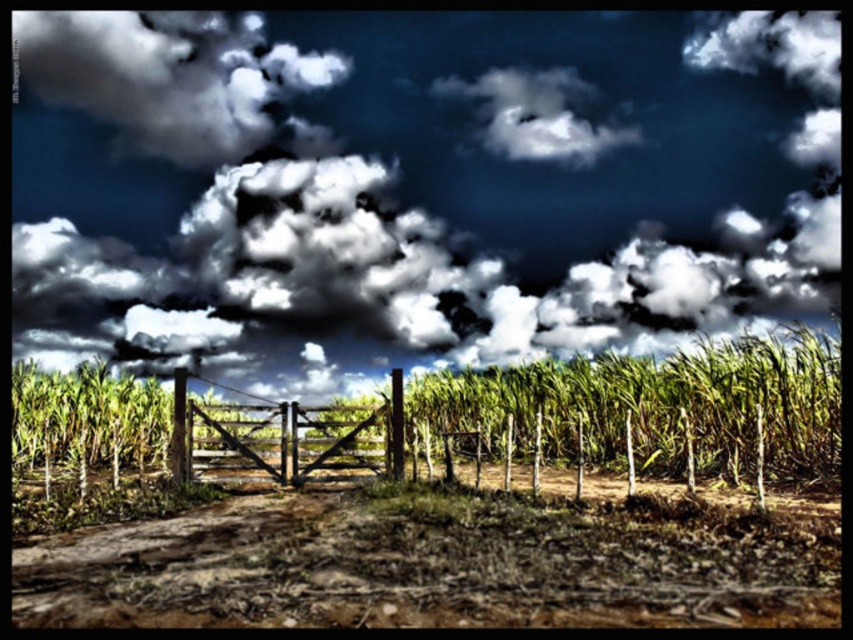
Question: Does brown soil at center have a lesser width compared to dark gray fluffy cloud at upper left?

Choices:
 (A) yes
 (B) no

Answer: (B)

Question: Which point is closer to the camera?

Choices:
 (A) (611, 600)
 (B) (810, 477)

Answer: (A)

Question: Which point is closer to the camera?

Choices:
 (A) (173, 547)
 (B) (750, 352)

Answer: (A)

Question: Which of these objects is positioned farthest from the brown soil at center?

Choices:
 (A) white fluffy cloud at upper center
 (B) wooden gate at center
 (C) dark gray fluffy cloud at upper left

Answer: (C)

Question: Is green grassy corn field at center bigger than wooden gate at center?

Choices:
 (A) no
 (B) yes

Answer: (A)

Question: Is brown soil at center smaller than dark gray fluffy cloud at upper left?

Choices:
 (A) no
 (B) yes

Answer: (A)